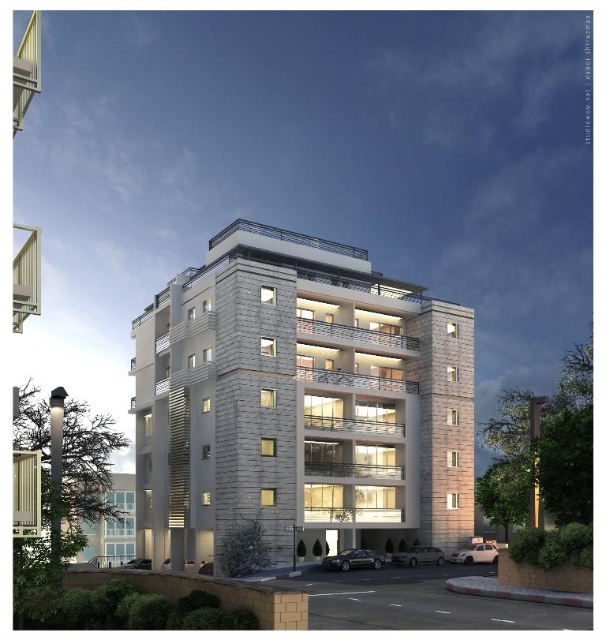
Is point (184, 352) farther from camera compared to point (115, 497)?

No, it is in front of (115, 497).

In the scene shown: Does white stone building at center appear on the right side of white stone building at lower left?

Correct, you'll find white stone building at center to the right of white stone building at lower left.

Does point (376, 449) come in front of point (88, 552)?

Yes, it is in front of point (88, 552).

You are a GUI agent. You are given a task and a screenshot of the screen. Output one action in this format:
    pyautogui.click(x=<x>, y=<y>)
    Task: Click on the white stone building at center
    
    Given the screenshot: What is the action you would take?
    pyautogui.click(x=301, y=403)